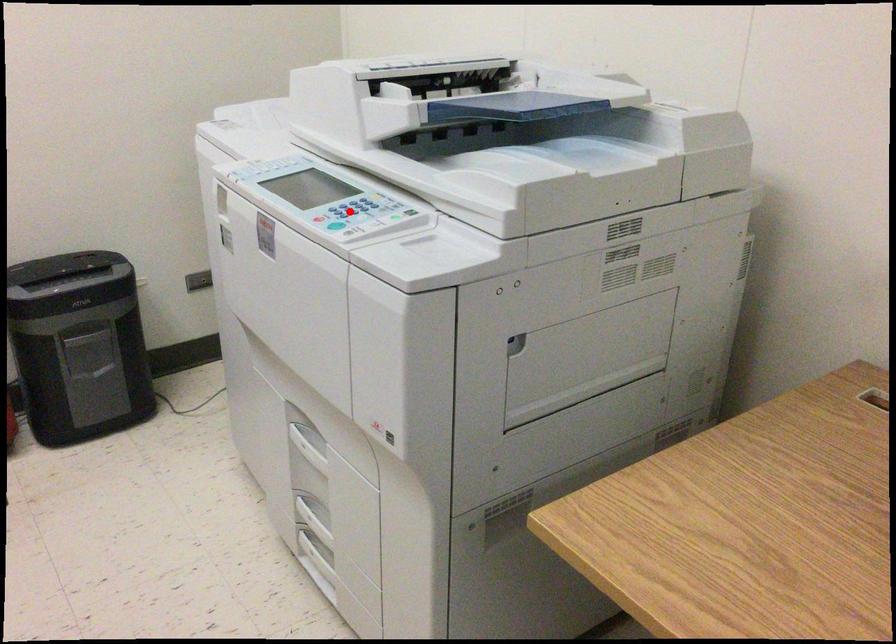
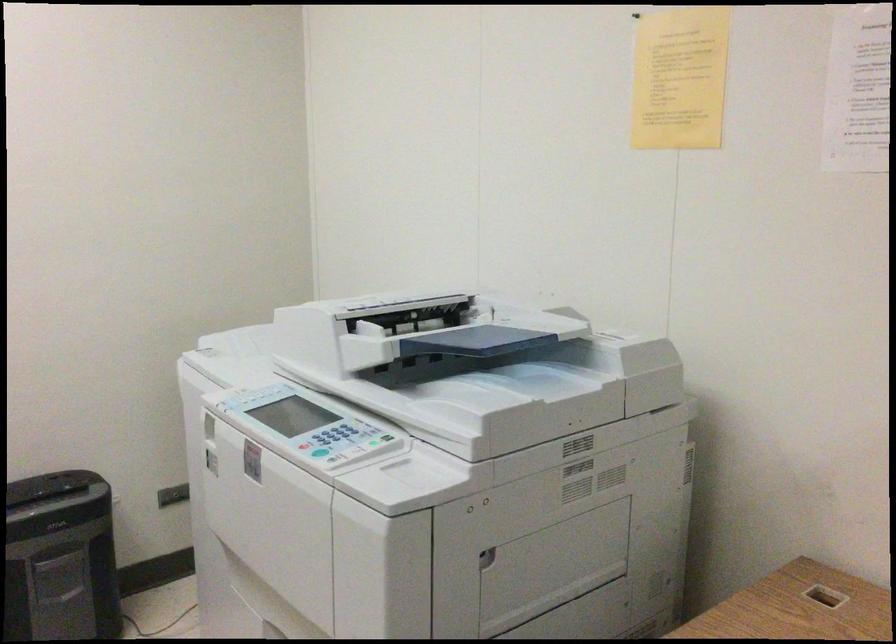
Locate, in the second image, the point that corresponds to the highlighted location in the first image.

(332, 438)